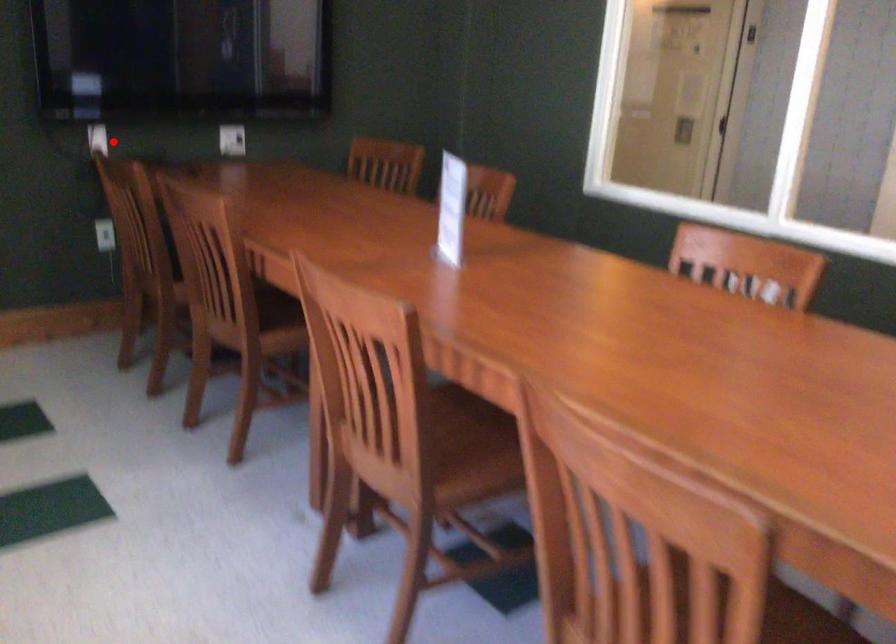
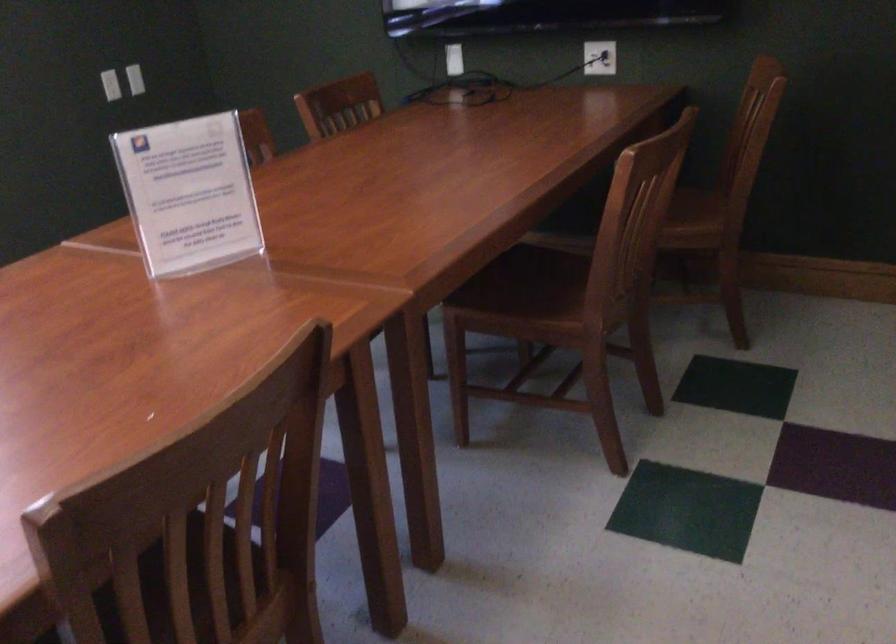
The point at the highlighted location is marked in the first image. Where is the corresponding point in the second image?

(453, 59)